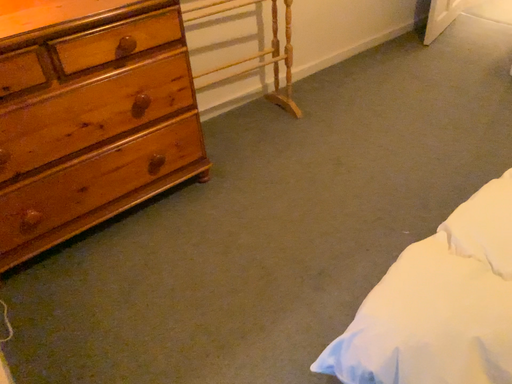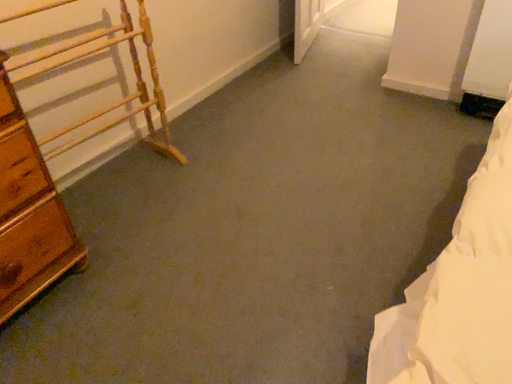
Question: How did the camera likely rotate when shooting the video?

Choices:
 (A) rotated right
 (B) rotated left

Answer: (A)